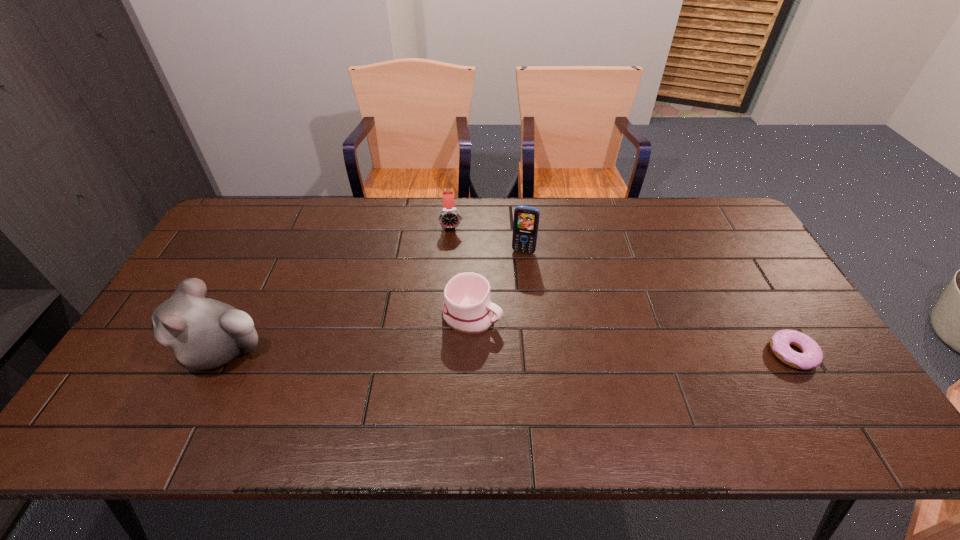
Identify the location of object that ranks as the second closest to the second object from right to left. (467, 308).

Identify which object is the fourth nearest to the mug. Please provide its 2D coordinates. Your answer should be formatted as a tuple, i.e. [(x, y)], where the tuple contains the x and y coordinates of a point satisfying the conditions above.

[(811, 357)]

This screenshot has width=960, height=540. I want to click on vacant area that satisfies the following two spatial constraints: 1. on the front side of the shortest object; 2. on the left side of the mug, so click(471, 353).